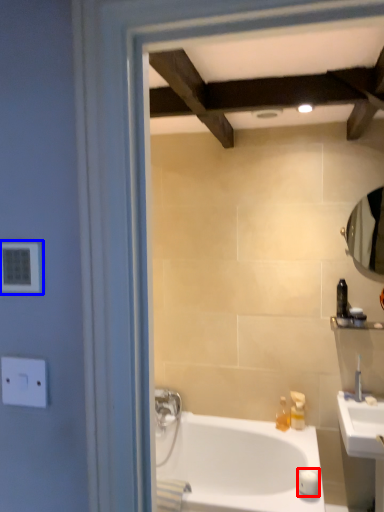
Question: Which object appears closest to the camera in this image, soap (highlighted by a red box) or electric outlet (highlighted by a blue box)?

Choices:
 (A) soap
 (B) electric outlet

Answer: (B)